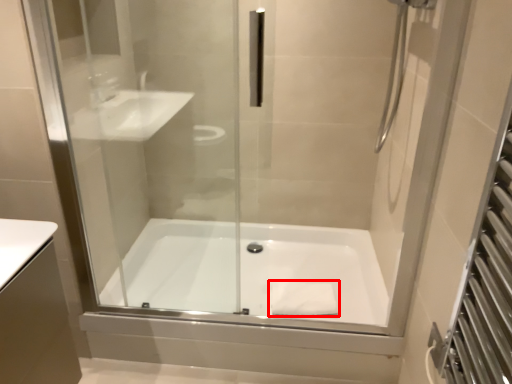
Question: Considering the relative positions of material (annotated by the red box) and bathtub in the image provided, where is material (annotated by the red box) located with respect to the staircase?

Choices:
 (A) left
 (B) right

Answer: (B)